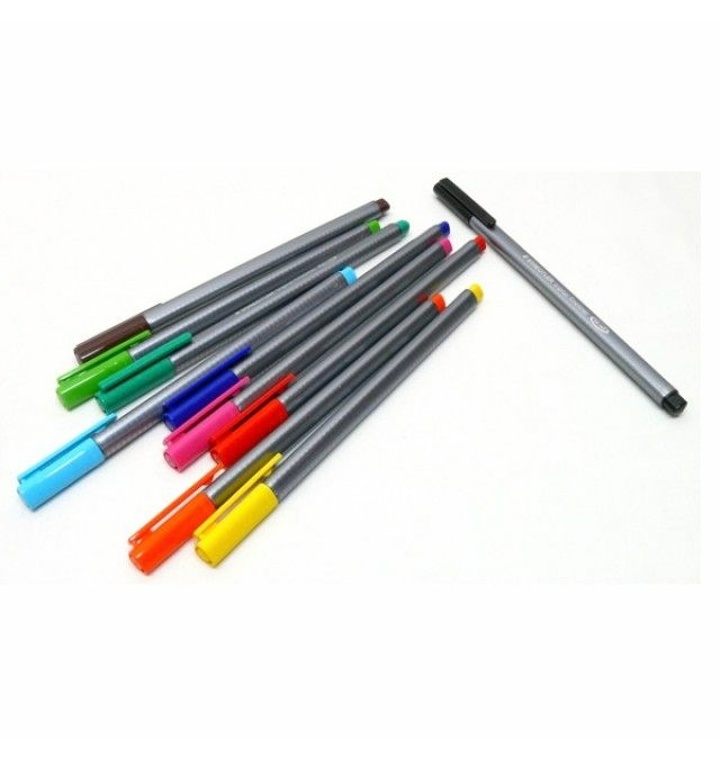
The height and width of the screenshot is (758, 720). I want to click on markers, so click(588, 317), click(368, 398), click(355, 384), click(297, 392), click(248, 393), click(225, 383), click(199, 371), click(171, 355), click(130, 352), click(139, 320).